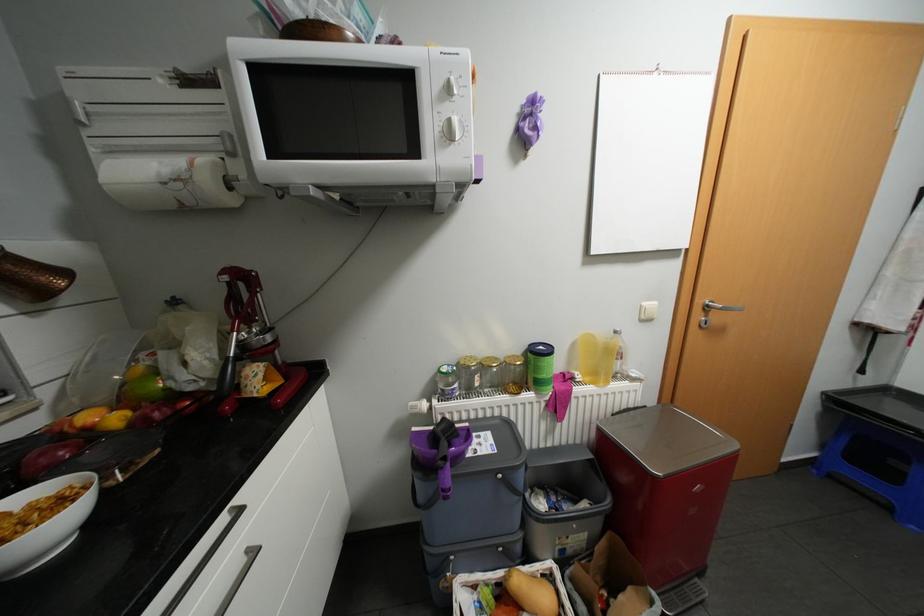
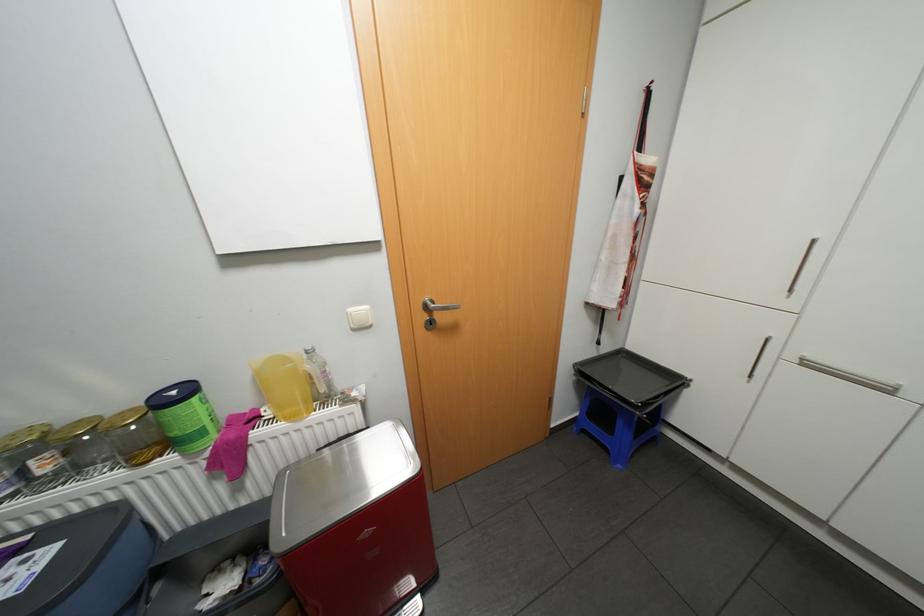
Find the pixel in the second image that matches point (544, 392) in the first image.

(190, 453)